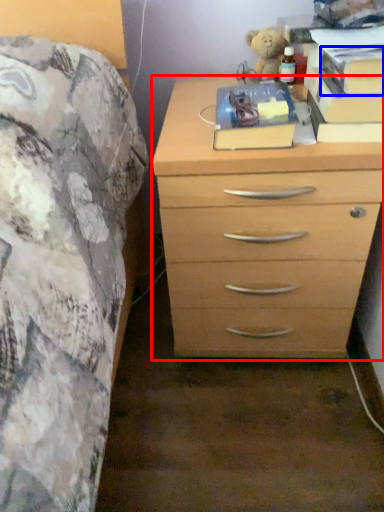
Question: Which object appears farthest to the camera in this image, chest of drawers (highlighted by a red box) or paperback book (highlighted by a blue box)?

Choices:
 (A) chest of drawers
 (B) paperback book

Answer: (A)